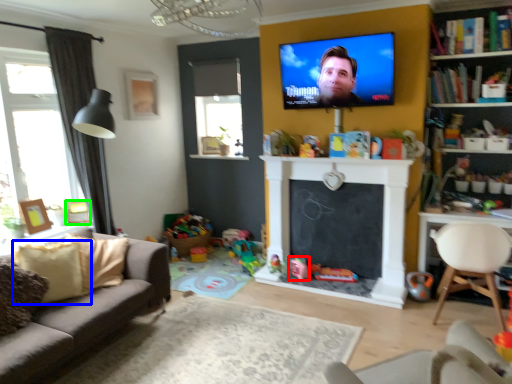
Question: Estimate the real-world distances between objects in this image. Which object is farther from toy (highlighted by a red box), pillow (highlighted by a blue box) or picture frame (highlighted by a green box)?

Choices:
 (A) pillow
 (B) picture frame

Answer: (A)